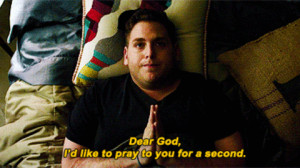
I want to click on bedding, so click(52, 58), click(50, 95), click(23, 8).